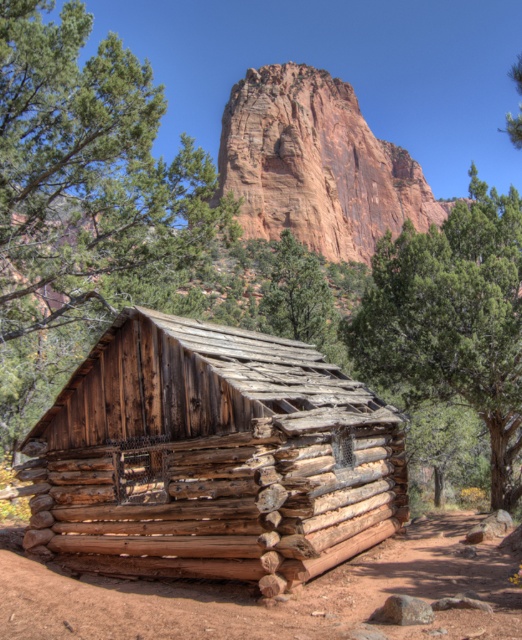
Looking at this image, is green leafy tree at center to the right of green rough bark tree at center from the viewer's perspective?

Indeed, green leafy tree at center is positioned on the right side of green rough bark tree at center.

Is the position of green leafy tree at center more distant than that of green rough bark tree at center?

No.

This screenshot has width=522, height=640. Describe the element at coordinates (453, 321) in the screenshot. I see `green leafy tree at center` at that location.

At what (x,y) coordinates should I click in order to perform the action: click on green leafy tree at center. Please return your answer as a coordinate pair (x, y). Image resolution: width=522 pixels, height=640 pixels. Looking at the image, I should click on (453, 321).

Who is more distant from viewer, (289, 442) or (281, 90)?

The point (281, 90) is behind.

Is point (125, 371) behind point (430, 211)?

That is False.

Locate an element on the screen. weathered wood cabin at center is located at coordinates (212, 456).

Is point (173, 352) less distant than point (204, 189)?

Yes, point (173, 352) is in front of point (204, 189).

Does weathered wood cabin at center appear on the left side of green rough bark tree at lower left?

No, weathered wood cabin at center is not to the left of green rough bark tree at lower left.

I want to click on weathered wood cabin at center, so click(x=212, y=456).